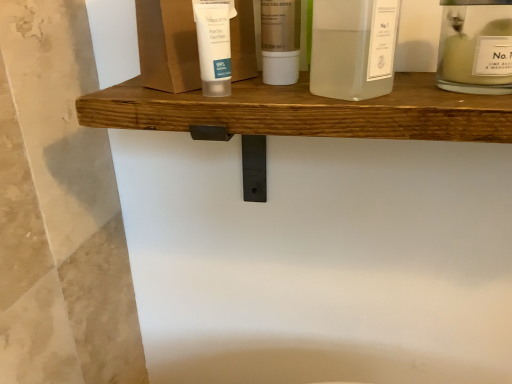
Question: In terms of size, does white matte tube at center, placed as the third toiletry when sorted from right to left, appear bigger or smaller than translucent plastic bottle at center, positioned as the 2th toiletry in left-to-right order?

Choices:
 (A) big
 (B) small

Answer: (B)

Question: Considering the positions of white matte tube at center, the first toiletry positioned from the left, and translucent plastic bottle at center, arranged as the 2th toiletry when viewed from the right, in the image, is white matte tube at center, the first toiletry positioned from the left, taller or shorter than translucent plastic bottle at center, arranged as the 2th toiletry when viewed from the right,?

Choices:
 (A) short
 (B) tall

Answer: (A)

Question: Which object is positioned farthest from the clear glass jar at upper right, the first toiletry when ordered from right to left?

Choices:
 (A) white matte tube at center, the first toiletry positioned from the left
 (B) translucent glass bottle at center, which is the second product from left to right
 (C) translucent plastic tube at upper center, acting as the 1th product starting from the left
 (D) translucent plastic bottle at center, positioned as the 2th toiletry in left-to-right order

Answer: (A)

Question: Which object is the closest to the translucent plastic bottle at center, arranged as the 2th toiletry when viewed from the right?

Choices:
 (A) clear glass jar at upper right, the third toiletry from the left
 (B) translucent glass bottle at center, which is the 1th product in right-to-left order
 (C) translucent plastic tube at upper center, the 2th product positioned from the right
 (D) white matte tube at center, the first toiletry positioned from the left

Answer: (C)